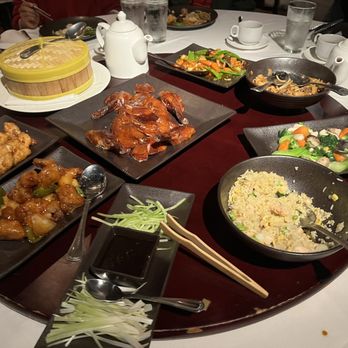
Locate an element on the screen. spoon is located at coordinates (89, 291).